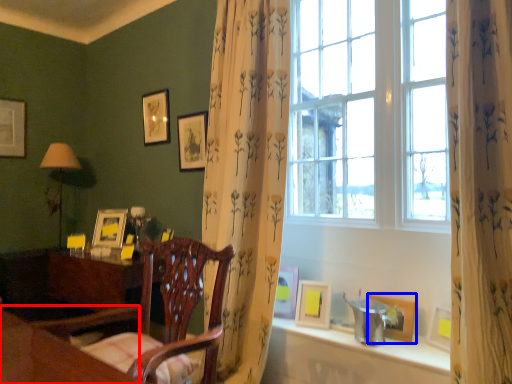
Question: Which object is closer to the camera taking this photo, table (highlighted by a red box) or picture frame (highlighted by a blue box)?

Choices:
 (A) table
 (B) picture frame

Answer: (A)